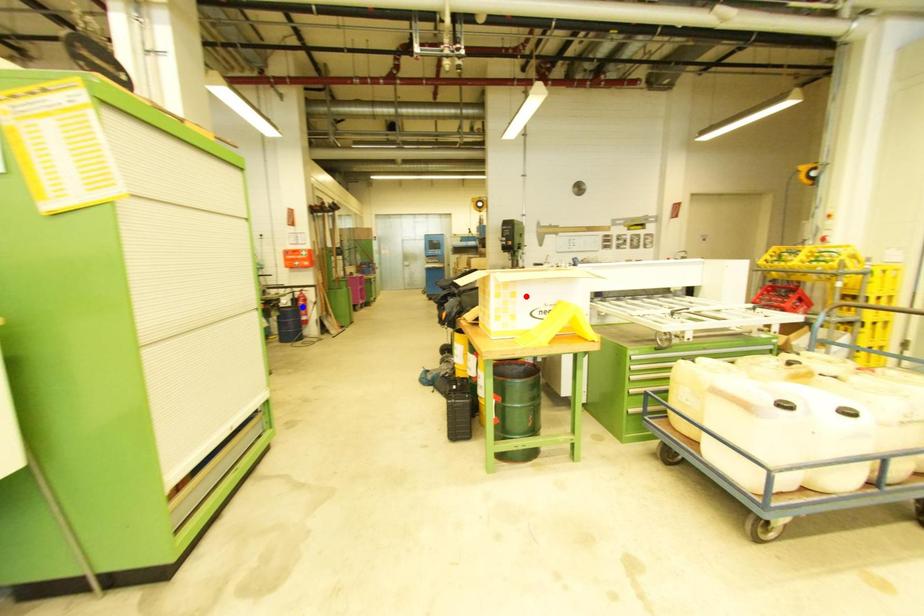
Question: Which of the two points in the image is closer to the camera?

Choices:
 (A) Blue point is closer.
 (B) Red point is closer.

Answer: (B)